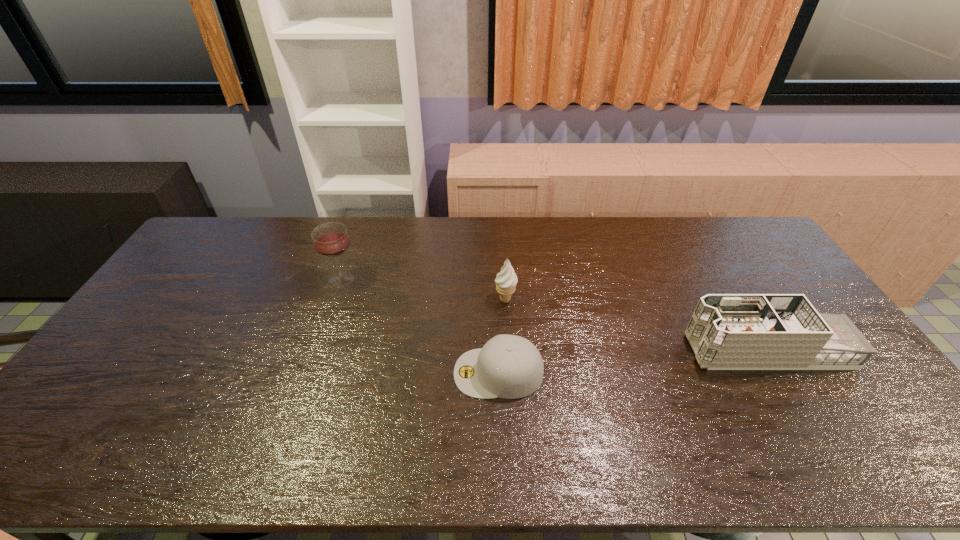
Find the location of a particular element. vacant space at the far left corner is located at coordinates (204, 246).

Where is `vacant space at the far right corner of the desktop`? This screenshot has width=960, height=540. vacant space at the far right corner of the desktop is located at coordinates (743, 218).

The height and width of the screenshot is (540, 960). What are the coordinates of `free space between the icecream and the wineglass` in the screenshot? It's located at (423, 290).

Where is `vacant space that's between the farthest object and the shortest object`? vacant space that's between the farthest object and the shortest object is located at coordinates (420, 326).

Where is `vacant space that's between the dollhouse and the third nearest object`? This screenshot has height=540, width=960. vacant space that's between the dollhouse and the third nearest object is located at coordinates (636, 325).

In order to click on vacant area that lies between the leftmost object and the second farthest object in this screenshot , I will do `click(423, 290)`.

This screenshot has width=960, height=540. I want to click on vacant area between the icecream and the dollhouse, so click(636, 325).

The image size is (960, 540). What are the coordinates of `free space between the third nearest object and the farthest object` in the screenshot? It's located at (423, 290).

At what (x,y) coordinates should I click in order to perform the action: click on unoccupied area between the third nearest object and the dollhouse. Please return your answer as a coordinate pair (x, y). Looking at the image, I should click on (636, 325).

Identify the location of the third closest object to the second farthest object. Image resolution: width=960 pixels, height=540 pixels. (727, 331).